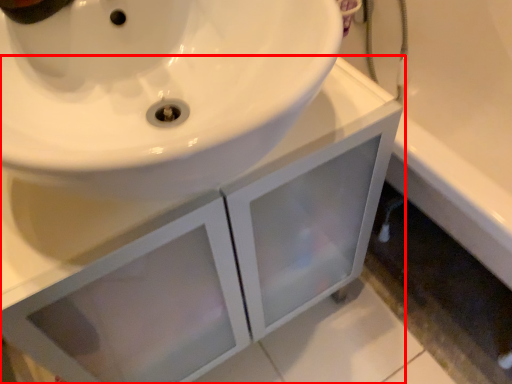
Question: From the image's perspective, what is the correct spatial relationship of bathroom cabinet (annotated by the red box) in relation to bath?

Choices:
 (A) below
 (B) above

Answer: (A)